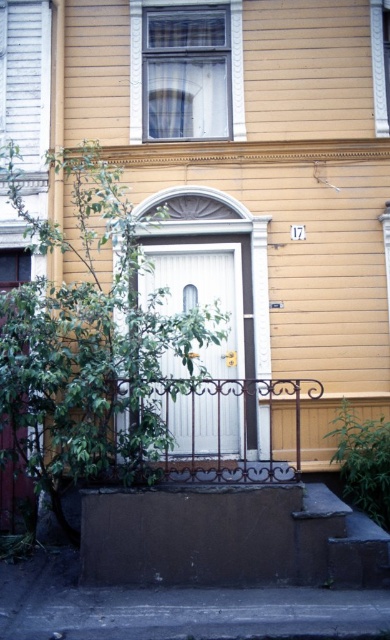
Consider the image. You are a delivery person trying to reach the white wood door at center. You see the brown concrete stair at lower center nearby. Can you step onto the stair to reach the door? Explain why.

The brown concrete stair at lower center is not as tall as the white wood door at center, so stepping onto the stair may help you reach the door since it is positioned lower and closer to the ground, providing a step up to the door level.

Looking at this image, you are a delivery person approaching the house and need to reach the white wood door at center. Which direction should you move relative to the brown concrete stair at lower center?

You should move to the right of the brown concrete stair at lower center to reach the white wood door at center since the stair is located to its left.

You are a delivery person approaching the brown concrete stair at lower center and the white wood door at center. Which object should you step onto first to reach the door?

You should step onto the brown concrete stair at lower center first because it is located below the white wood door at center, which means it is the pathway leading up to the door.